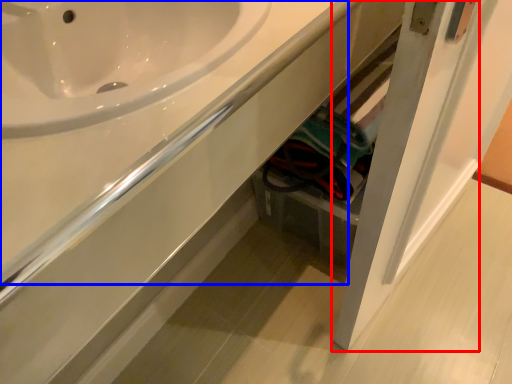
Question: Which object appears closest to the camera in this image, door (highlighted by a red box) or counter top (highlighted by a blue box)?

Choices:
 (A) door
 (B) counter top

Answer: (B)